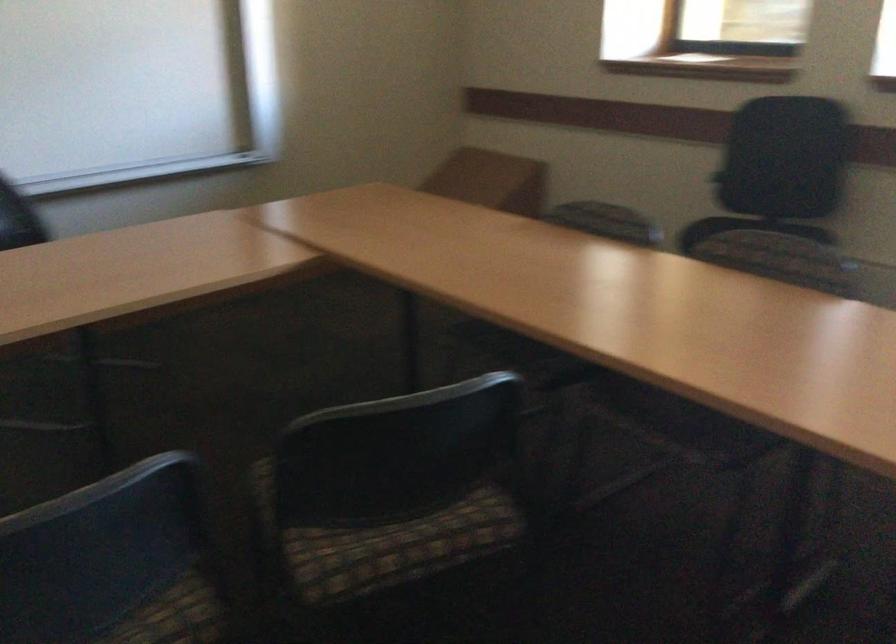
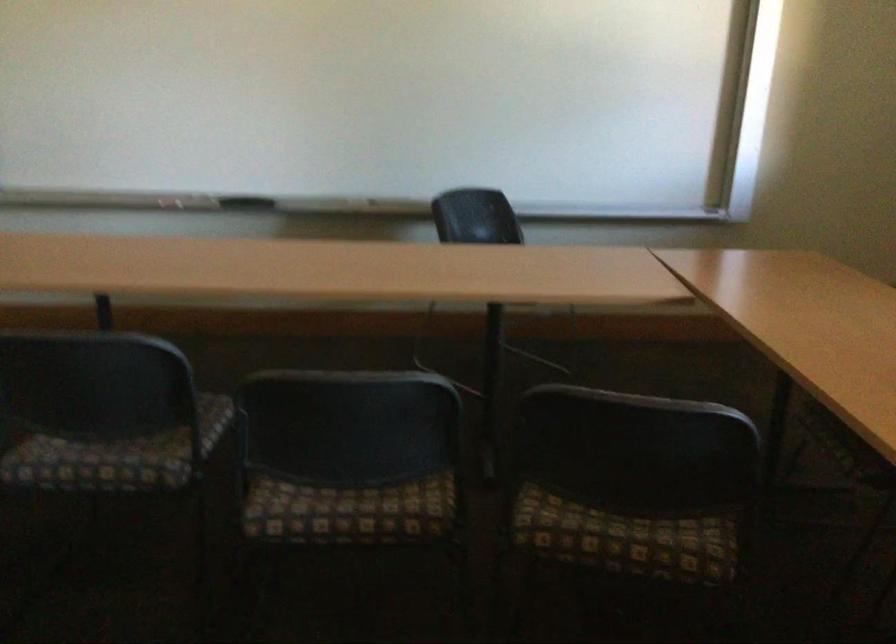
Question: The camera is either moving clockwise (left) or counter-clockwise (right) around the object. The first image is from the beginning of the video and the second image is from the end. Is the camera moving left or right when shooting the video?

Choices:
 (A) Left
 (B) Right

Answer: (B)